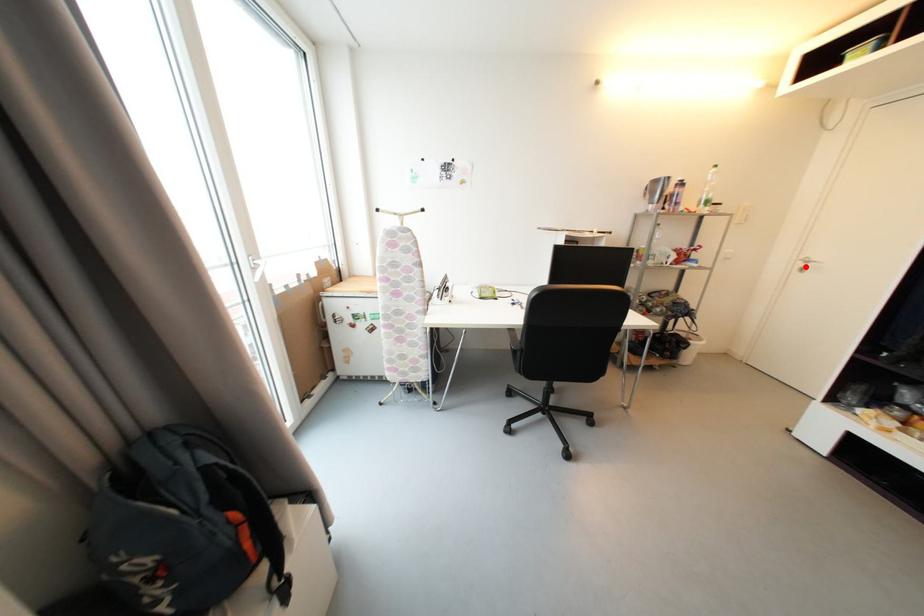
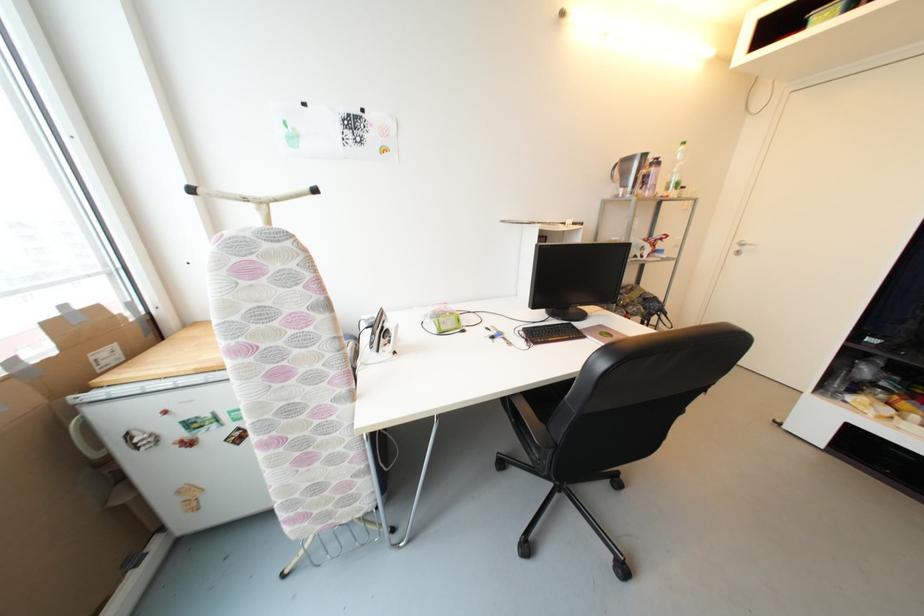
Locate, in the second image, the point that corresponds to the highlighted location in the first image.

(742, 249)